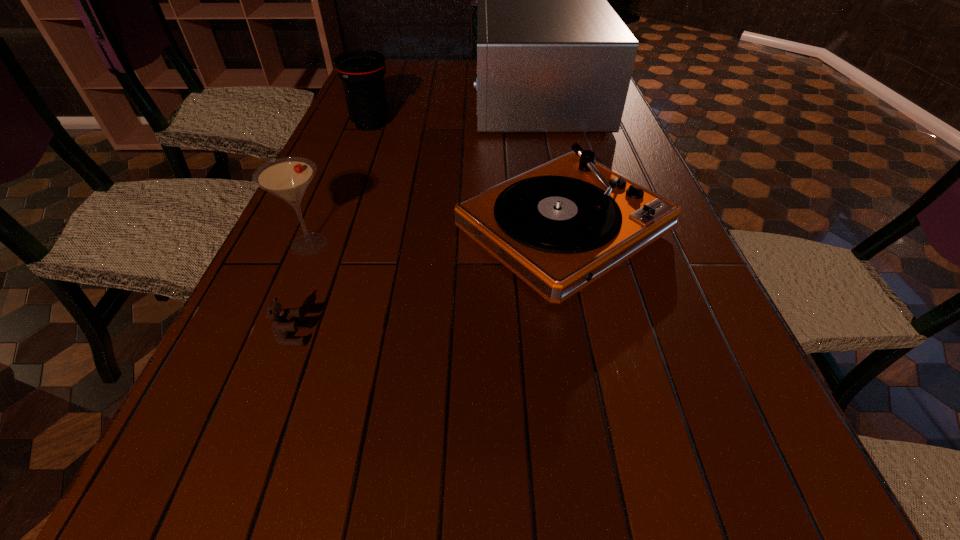
This screenshot has height=540, width=960. Find the location of `unoccupied position between the martini and the record player`. unoccupied position between the martini and the record player is located at coordinates (437, 237).

Identify the location of object that is the third closest to the telephoto lens. Image resolution: width=960 pixels, height=540 pixels. click(x=288, y=178).

Identify which object is the third nearest to the martini. Please provide its 2D coordinates. Your answer should be formatted as a tuple, i.e. [(x, y)], where the tuple contains the x and y coordinates of a point satisfying the conditions above.

[(362, 72)]

This screenshot has height=540, width=960. Identify the location of free space that satisfies the following two spatial constraints: 1. with the door open on the microwave oven; 2. on the front side of the telephoto lens. (543, 124).

In order to click on vacant space that satisfies the following two spatial constraints: 1. on the back side of the record player; 2. on the left side of the martini in this screenshot , I will do `click(316, 230)`.

Identify the location of free spot that satisfies the following two spatial constraints: 1. on the back side of the telephoto lens; 2. on the right side of the martini. (360, 124).

Locate an element on the screen. The height and width of the screenshot is (540, 960). vacant position in the image that satisfies the following two spatial constraints: 1. with the door open on the tallest object; 2. on the front side of the fourth tallest object is located at coordinates (566, 230).